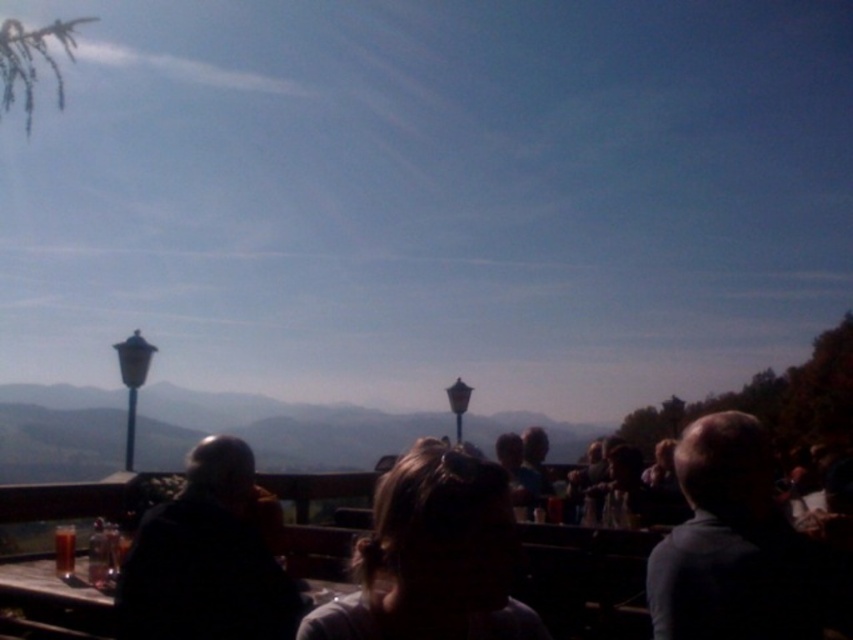
You are a photographer trying to capture a photo of the light brown hair at center and dark gray hair at right. Based on their positions, which person should you focus on first to ensure both are in frame?

The light brown hair at center is above dark gray hair at right, so you should focus on the light brown hair at center first to ensure both are in frame since it is positioned higher up.

You are a photographer trying to capture a photo of the dark brown leather jacket at center and the wooden table at lower left. Since the lighting is tricky due to the backlighting, you want to ensure both subjects are visible. Given their sizes, which object might be easier to frame properly in the shot?

The wooden table at lower left is shorter than the dark brown leather jacket at center. Since the jacket is much taller, it might block the table if positioned closely. To frame both properly, you could position the jacket slightly behind or to the side of the table to avoid obstruction.

You are a photographer trying to capture a photo of the dark gray hair at right and the wooden table at lower left. Which object will appear larger in the photo?

The dark gray hair at right is much taller than the wooden table at lower left, so it will appear larger in the photo.